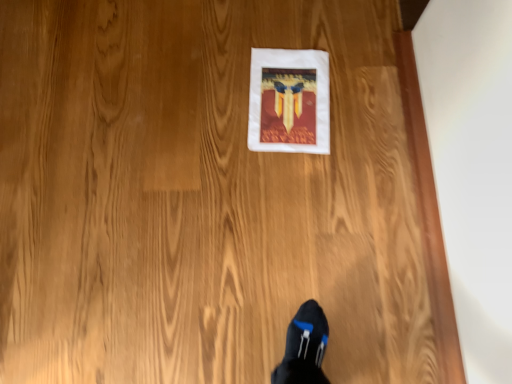
Locate an element on the screen. This screenshot has width=512, height=384. vacant space in front of matte paper comic book at center is located at coordinates (288, 203).